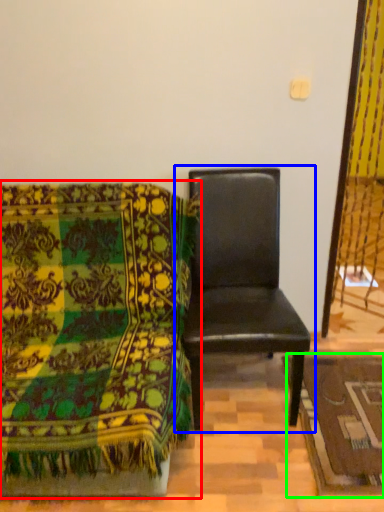
Question: Based on their relative distances, which object is farther from chair (highlighted by a red box)? Choose from chair (highlighted by a blue box) and mat (highlighted by a green box).

Choices:
 (A) chair
 (B) mat

Answer: (B)